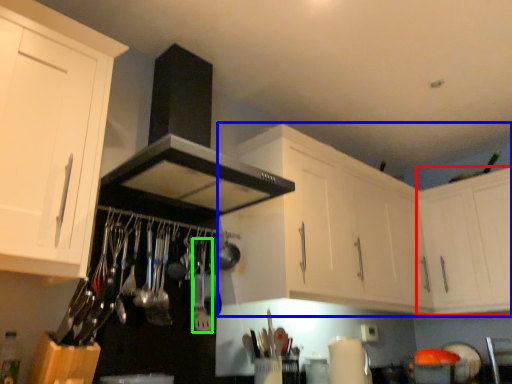
Question: Based on their relative distances, which object is farther from cabinetry (highlighted by a red box)? Choose from cabinetry (highlighted by a blue box) and silverware (highlighted by a green box).

Choices:
 (A) cabinetry
 (B) silverware

Answer: (B)